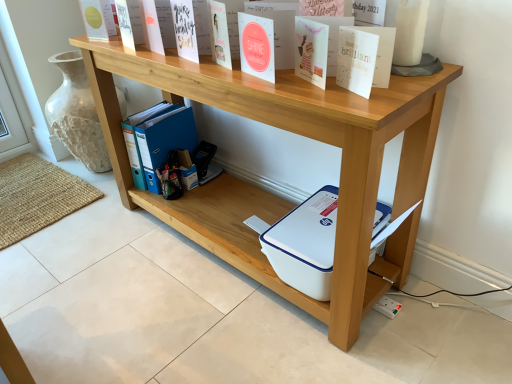
Question: From a real-world perspective, is matte yellow card at upper left, which is counted as the third paperback book, starting from the bottom, on blue plastic ring binder at lower center?

Choices:
 (A) yes
 (B) no

Answer: (A)

Question: Can you see matte yellow card at upper left, the 1th paperback book in the top-to-bottom sequence, touching blue plastic ring binder at lower center?

Choices:
 (A) yes
 (B) no

Answer: (B)

Question: Does matte yellow card at upper left, which is counted as the third paperback book, starting from the front, have a greater width compared to blue plastic ring binder at lower center?

Choices:
 (A) no
 (B) yes

Answer: (A)

Question: Is matte yellow card at upper left, the 1th paperback book in the top-to-bottom sequence, to the left of blue plastic ring binder at lower center from the viewer's perspective?

Choices:
 (A) no
 (B) yes

Answer: (B)

Question: From the image's perspective, is matte yellow card at upper left, which is counted as the third paperback book, starting from the bottom, beneath blue plastic ring binder at lower center?

Choices:
 (A) yes
 (B) no

Answer: (B)

Question: From the image's perspective, is white plastic printer at lower center, which appears as the 1th shelf when ordered from the bottom, positioned above or below matte yellow card at upper left, which is counted as the third paperback book, starting from the front?

Choices:
 (A) below
 (B) above

Answer: (A)

Question: Visually, is white plastic printer at lower center, which appears as the 1th shelf when ordered from the bottom, positioned to the left or to the right of matte yellow card at upper left, positioned as the third paperback book in right-to-left order?

Choices:
 (A) right
 (B) left

Answer: (A)

Question: Is point (158, 210) closer or farther from the camera than point (99, 28)?

Choices:
 (A) farther
 (B) closer

Answer: (A)

Question: Looking at the image, does white plastic printer at lower center, positioned as the 2th shelf in top-to-bottom order, seem bigger or smaller compared to matte yellow card at upper left, which is counted as the third paperback book, starting from the front?

Choices:
 (A) big
 (B) small

Answer: (A)

Question: Looking at the image, does white paper at upper right, the 3th paperback book in the back-to-front sequence, seem bigger or smaller compared to white plastic printer at lower center, which appears as the 1th shelf when ordered from the bottom?

Choices:
 (A) big
 (B) small

Answer: (B)

Question: From a real-world perspective, is white paper at upper right, which is the 1th paperback book in front-to-back order, above or below white plastic printer at lower center, positioned as the 2th shelf in top-to-bottom order?

Choices:
 (A) above
 (B) below

Answer: (A)

Question: Looking at their shapes, would you say white paper at upper right, the 1th paperback book from the right, is wider or thinner than white plastic printer at lower center, which appears as the 1th shelf when ordered from the bottom?

Choices:
 (A) thin
 (B) wide

Answer: (A)

Question: Choose the correct answer: Is white paper at upper right, the 1th paperback book from the right, inside white plastic printer at lower center, positioned as the 2th shelf in top-to-bottom order, or outside it?

Choices:
 (A) inside
 (B) outside

Answer: (B)

Question: Considering the positions of point pyautogui.click(x=369, y=94) and point pyautogui.click(x=429, y=99), is point pyautogui.click(x=369, y=94) closer or farther from the camera than point pyautogui.click(x=429, y=99)?

Choices:
 (A) closer
 (B) farther

Answer: (A)

Question: Is white paper at upper right, which is the 1th paperback book in front-to-back order, in front of or behind natural wood shelf at upper center, placed as the 2th shelf when sorted from bottom to top, in the image?

Choices:
 (A) front
 (B) behind

Answer: (B)